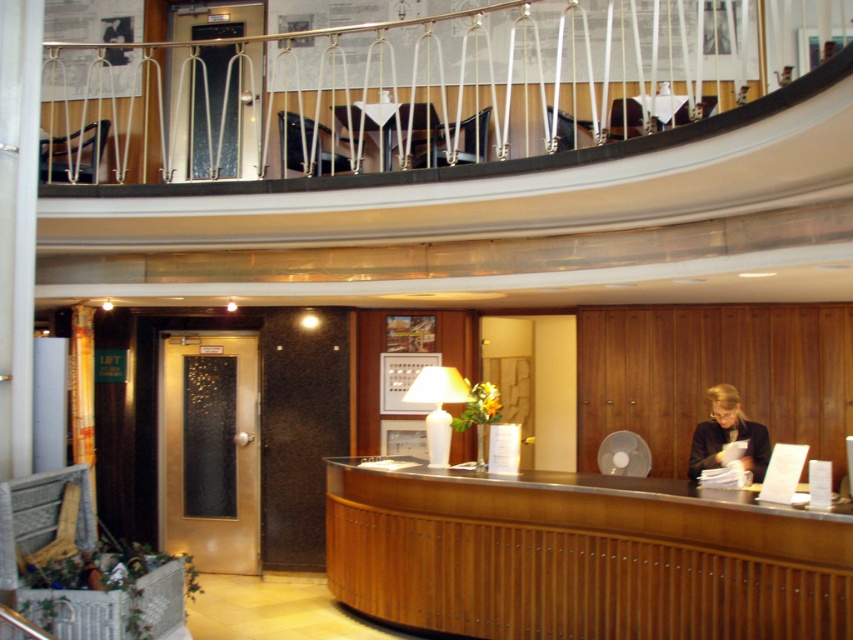
Between point (654, 541) and point (691, 467), which one is positioned in front?

Point (654, 541)

Is wooden reception desk at center behind black fabric jacket at center?

No, wooden reception desk at center is in front of black fabric jacket at center.

Who is more distant from viewer, [460,568] or [717,420]?

The point [717,420] is behind.

Where is `wooden reception desk at center`? This screenshot has width=853, height=640. wooden reception desk at center is located at coordinates (581, 556).